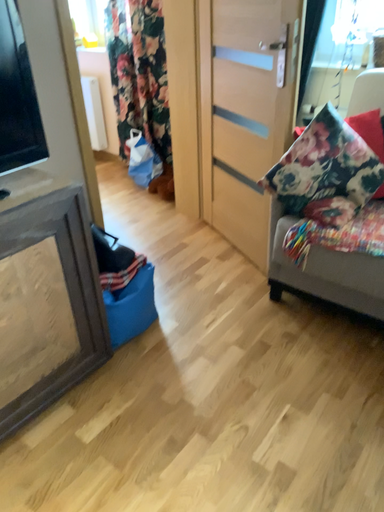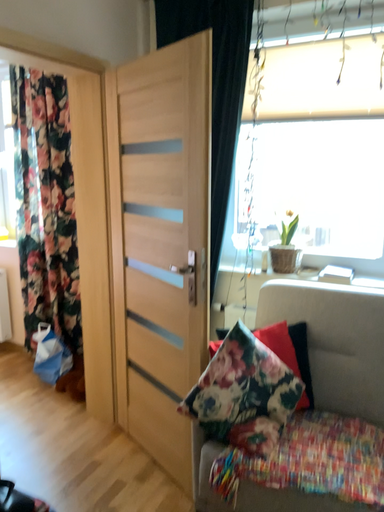
Question: How did the camera likely rotate when shooting the video?

Choices:
 (A) rotated right
 (B) rotated left

Answer: (A)